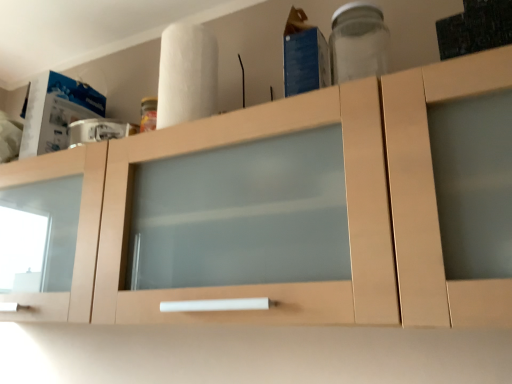
Where is `transparent glass jar at upper right`? transparent glass jar at upper right is located at coordinates (358, 42).

You are a GUI agent. You are given a task and a screenshot of the screen. Output one action in this format:
    pyautogui.click(x=<x>, y=<y>)
    Task: Click on the white matte paper towel at upper center
    The height and width of the screenshot is (384, 512).
    Given the screenshot: What is the action you would take?
    pyautogui.click(x=186, y=74)

Based on the photo, which object is wider, white matte paper towel at upper center or light wood cabinet at center?

light wood cabinet at center.

Which point is more distant from viewer, (189, 99) or (498, 64)?

Positioned behind is point (189, 99).

Can you confirm if white matte paper towel at upper center is taller than light wood cabinet at center?

In fact, white matte paper towel at upper center may be shorter than light wood cabinet at center.

Is white matte paper towel at upper center positioned with its back to light wood cabinet at center?

No, white matte paper towel at upper center is not facing the opposite direction of light wood cabinet at center.

Locate an element on the screen. This screenshot has height=384, width=512. paper towel located above the light wood cabinet at center (from the image's perspective) is located at coordinates (186, 74).

From a real-world perspective, is light wood cabinet at center physically below white matte paper towel at upper center?

Yes.

From the image's perspective, is light wood cabinet at center located above or below white matte paper towel at upper center?

Clearly, from the image's perspective, light wood cabinet at center is below white matte paper towel at upper center.

Which of these two, white matte paper towel at upper center or transparent glass jar at upper right, stands shorter?

transparent glass jar at upper right is shorter.

How distant is white matte paper towel at upper center from transparent glass jar at upper right?

The distance of white matte paper towel at upper center from transparent glass jar at upper right is 13.15 inches.

Does white matte paper towel at upper center have a smaller size compared to transparent glass jar at upper right?

No, white matte paper towel at upper center is not smaller than transparent glass jar at upper right.

Which object is positioned more to the right, transparent glass jar at upper right or white matte paper towel at upper center?

Positioned to the right is transparent glass jar at upper right.

Relative to white matte paper towel at upper center, is transparent glass jar at upper right in front or behind?

Clearly, transparent glass jar at upper right is in front of white matte paper towel at upper center.

Is point (373, 38) farther from camera compared to point (202, 44)?

Yes, it is behind point (202, 44).

Does transparent glass jar at upper right contain white matte paper towel at upper center?

No, white matte paper towel at upper center is not a part of transparent glass jar at upper right.

From the image's perspective, is light wood cabinet at center positioned above or below transparent glass jar at upper right?

light wood cabinet at center is situated lower than transparent glass jar at upper right in the image.

How many degrees apart are the facing directions of light wood cabinet at center and transparent glass jar at upper right?

They differ by 0.000864 degrees in their facing directions.

Is light wood cabinet at center positioned behind transparent glass jar at upper right?

No, the depth of light wood cabinet at center is less than that of transparent glass jar at upper right.

Would you consider light wood cabinet at center to be distant from transparent glass jar at upper right?

That's not correct — light wood cabinet at center is a little close to transparent glass jar at upper right.

Between transparent glass jar at upper right and light wood cabinet at center, which one appears on the left side from the viewer's perspective?

From the viewer's perspective, light wood cabinet at center appears more on the left side.

From the image's perspective, which is above, transparent glass jar at upper right or light wood cabinet at center?

From the image's view, transparent glass jar at upper right is above.

Which is in front, transparent glass jar at upper right or light wood cabinet at center?

light wood cabinet at center.

The width and height of the screenshot is (512, 384). In order to click on cabinetry on the left side of white matte paper towel at upper center in this screenshot , I will do `click(434, 197)`.

Locate an element on the screen. The height and width of the screenshot is (384, 512). paper towel behind the light wood cabinet at center is located at coordinates (186, 74).

Based on their spatial positions, is white matte paper towel at upper center or transparent glass jar at upper right further from light wood cabinet at center?

transparent glass jar at upper right lies further to light wood cabinet at center than the other object.

Consider the image. Based on their spatial positions, is light wood cabinet at center or transparent glass jar at upper right further from white matte paper towel at upper center?

Among the two, transparent glass jar at upper right is located further to white matte paper towel at upper center.

When comparing their distances from transparent glass jar at upper right, does light wood cabinet at center or white matte paper towel at upper center seem closer?

Based on the image, white matte paper towel at upper center appears to be nearer to transparent glass jar at upper right.

Estimate the real-world distances between objects in this image. Which object is further from transparent glass jar at upper right, white matte paper towel at upper center or light wood cabinet at center?

Among the two, light wood cabinet at center is located further to transparent glass jar at upper right.

Looking at the image, which one is located closer to white matte paper towel at upper center, transparent glass jar at upper right or light wood cabinet at center?

light wood cabinet at center.

Considering their positions, is transparent glass jar at upper right positioned further to light wood cabinet at center than white matte paper towel at upper center?

transparent glass jar at upper right is further to light wood cabinet at center.

The height and width of the screenshot is (384, 512). I want to click on paper towel between light wood cabinet at center and transparent glass jar at upper right in the horizontal direction, so click(x=186, y=74).